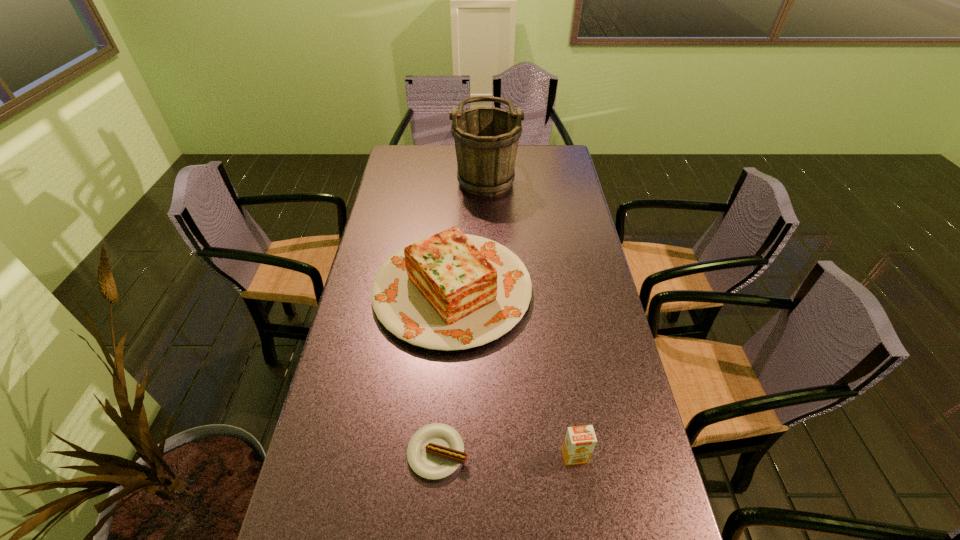
This screenshot has height=540, width=960. In order to click on bucket in this screenshot , I will do `click(486, 139)`.

Where is `the tallest object`? the tallest object is located at coordinates (486, 139).

At what (x,y) coordinates should I click in order to perform the action: click on the third nearest object. Please return your answer as a coordinate pair (x, y). The width and height of the screenshot is (960, 540). Looking at the image, I should click on (451, 291).

Where is `the second tallest object`? the second tallest object is located at coordinates (451, 291).

Find the location of a particular element. The image size is (960, 540). orange juice is located at coordinates (579, 443).

This screenshot has height=540, width=960. Find the location of `the third tallest object`. the third tallest object is located at coordinates (579, 443).

Locate an element on the screen. The image size is (960, 540). sausage is located at coordinates (435, 451).

This screenshot has width=960, height=540. In order to click on vacant space situated 0.080m on the handle side of the bucket in this screenshot , I will do `click(435, 173)`.

Identify the location of vacant space located on the handle side of the bucket. (417, 173).

Find the location of a particular element. Image resolution: width=960 pixels, height=540 pixels. free point located on the handle side of the bucket is located at coordinates (440, 173).